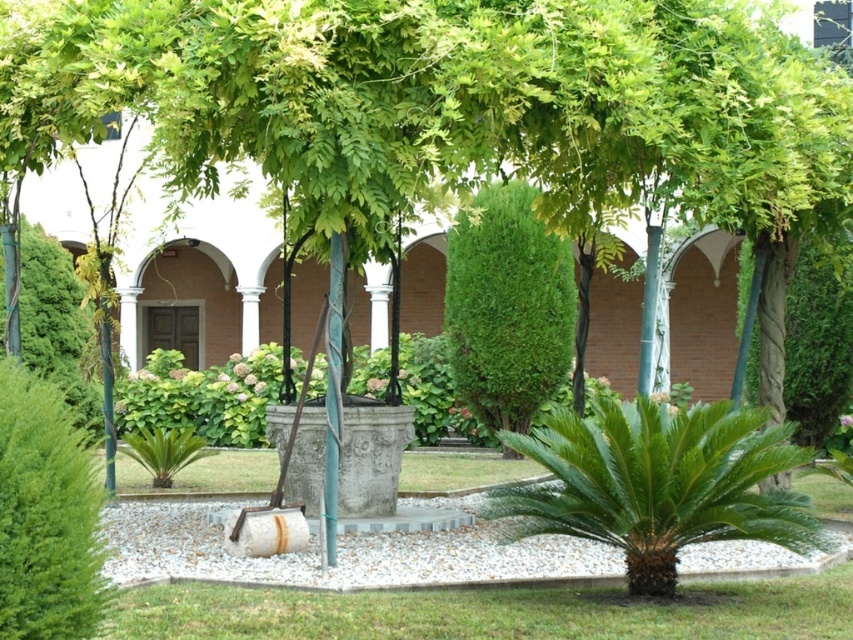
From the picture: You are standing in the garden and want to water the green leafy palm at center. Which direction should you move to reach it?

The green leafy palm at center is located at point (659,483), so you should move towards the center of the garden to reach it.

You are designing a garden layout and need to place two green leafy bushes. The scene shows a green leafy bush at center and a green leafy bush at left. Which one is thinner?

The green leafy bush at center is thinner than the green leafy bush at left.